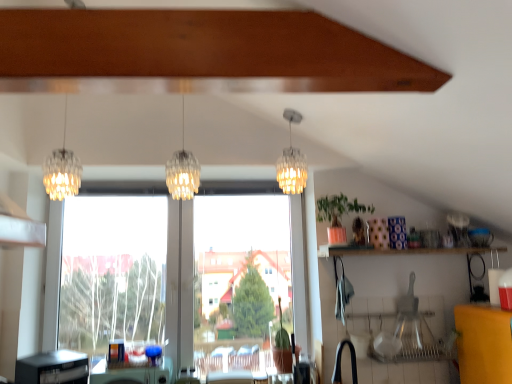
Question: Is translucent glass chandelier at left, the 3th lamp from the right, located outside clear glass chandelier at center, the first lamp in the right-to-left sequence?

Choices:
 (A) yes
 (B) no

Answer: (A)

Question: Considering the relative positions of translucent glass chandelier at left, the 3th lamp from the right, and clear glass chandelier at center, positioned as the 3th lamp in left-to-right order, in the image provided, is translucent glass chandelier at left, the 3th lamp from the right, behind clear glass chandelier at center, positioned as the 3th lamp in left-to-right order,?

Choices:
 (A) no
 (B) yes

Answer: (A)

Question: From a real-world perspective, is translucent glass chandelier at left, the 3th lamp from the right, on top of clear glass chandelier at center, the first lamp in the right-to-left sequence?

Choices:
 (A) yes
 (B) no

Answer: (A)

Question: Is translucent glass chandelier at left, the 3th lamp from the right, far from clear glass chandelier at center, the first lamp in the right-to-left sequence?

Choices:
 (A) no
 (B) yes

Answer: (B)

Question: Considering the relative sizes of translucent glass chandelier at left, the 1th lamp from the left, and clear glass chandelier at center, positioned as the 3th lamp in left-to-right order, in the image provided, is translucent glass chandelier at left, the 1th lamp from the left, bigger than clear glass chandelier at center, positioned as the 3th lamp in left-to-right order,?

Choices:
 (A) no
 (B) yes

Answer: (B)

Question: From the image's perspective, is black rubber faucet at lower center positioned above or below transparent glass window at center?

Choices:
 (A) below
 (B) above

Answer: (A)

Question: Is black rubber faucet at lower center inside or outside of transparent glass window at center?

Choices:
 (A) inside
 (B) outside

Answer: (B)

Question: Considering their positions, is black rubber faucet at lower center located in front of or behind transparent glass window at center?

Choices:
 (A) behind
 (B) front

Answer: (B)

Question: Is point (345, 339) positioned closer to the camera than point (225, 344)?

Choices:
 (A) farther
 (B) closer

Answer: (B)

Question: Visually, is translucent glass chandelier at left, the 3th lamp from the right, positioned to the left or to the right of clear glass chandelier at center, positioned as the 3th lamp in left-to-right order?

Choices:
 (A) right
 (B) left

Answer: (B)

Question: Relative to clear glass chandelier at center, positioned as the 3th lamp in left-to-right order, is translucent glass chandelier at left, the 1th lamp from the left, in front or behind?

Choices:
 (A) front
 (B) behind

Answer: (A)

Question: From a real-world perspective, relative to clear glass chandelier at center, the first lamp in the right-to-left sequence, is translucent glass chandelier at left, the 3th lamp from the right, vertically above or below?

Choices:
 (A) below
 (B) above

Answer: (B)

Question: Is translucent glass chandelier at left, the 3th lamp from the right, inside or outside of clear glass chandelier at center, positioned as the 3th lamp in left-to-right order?

Choices:
 (A) inside
 (B) outside

Answer: (B)

Question: In terms of height, does green plastic table at lower center look taller or shorter compared to black plastic dishwasher at lower left?

Choices:
 (A) short
 (B) tall

Answer: (A)

Question: Is green plastic table at lower center situated inside black plastic dishwasher at lower left or outside?

Choices:
 (A) outside
 (B) inside

Answer: (A)